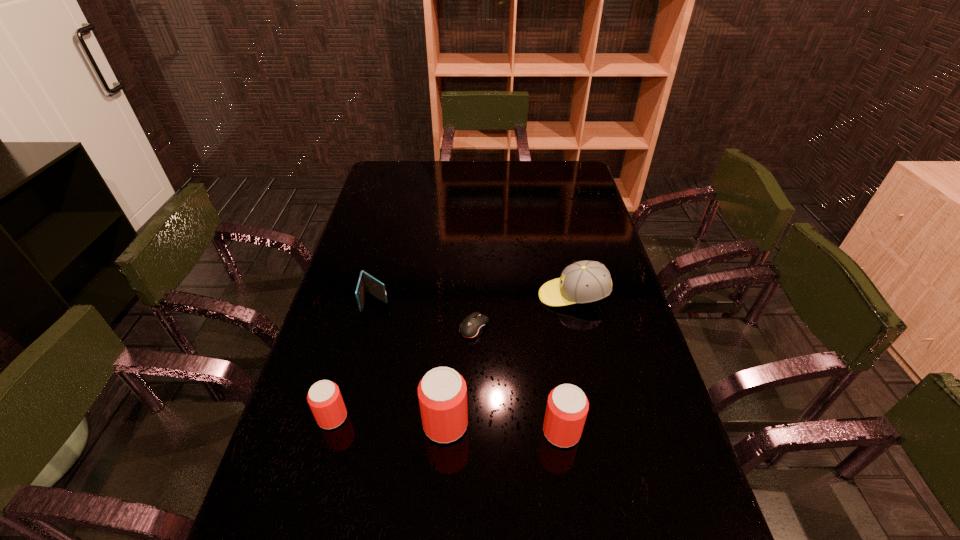
Identify the location of free space at the near edge of the desktop. The image size is (960, 540). (374, 517).

Identify the location of vacant space at the left edge. The image size is (960, 540). (397, 240).

Identify the location of free location at the right edge of the desktop. (613, 285).

Locate an element on the screen. The width and height of the screenshot is (960, 540). vacant region at the far left corner is located at coordinates (378, 174).

In order to click on free spot at the near left corner of the desktop in this screenshot , I will do `click(261, 495)`.

The height and width of the screenshot is (540, 960). In the image, there is a desktop. Identify the location of vacant space at the near right corner. (673, 529).

Where is `empty space that is in between the baseball cap and the shortest beer can`? empty space that is in between the baseball cap and the shortest beer can is located at coordinates (453, 356).

Find the location of `vacant space that's between the shortest beer can and the wallet`. vacant space that's between the shortest beer can and the wallet is located at coordinates (354, 359).

Find the location of a particular element. This screenshot has height=540, width=960. free space between the baseball cap and the leftmost beer can is located at coordinates (453, 356).

You are a GUI agent. You are given a task and a screenshot of the screen. Output one action in this format:
    pyautogui.click(x=<x>, y=<y>)
    Task: Click on the free space between the tallest beer can and the wallet
    
    Given the screenshot: What is the action you would take?
    pyautogui.click(x=411, y=362)